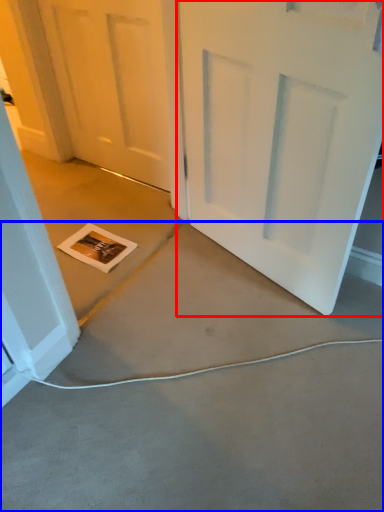
Question: Which of the following is the closest to the observer, door (highlighted by a red box) or concrete (highlighted by a blue box)?

Choices:
 (A) door
 (B) concrete

Answer: (B)